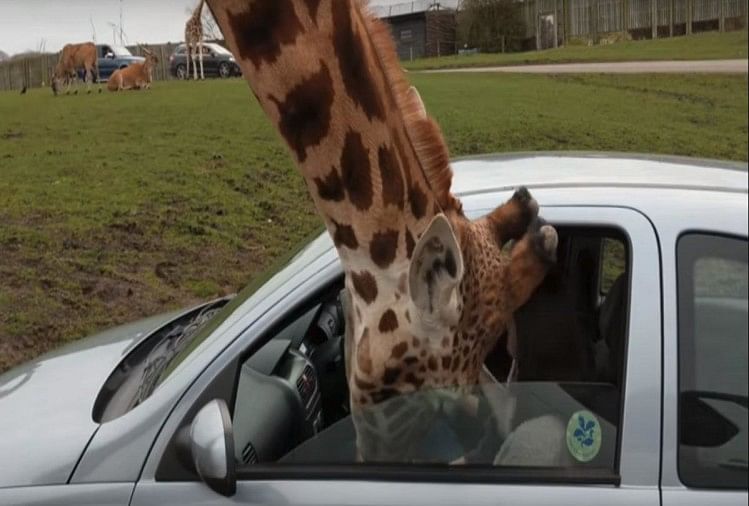
Identify the location of windows. The height and width of the screenshot is (506, 749). (487, 431), (718, 412).